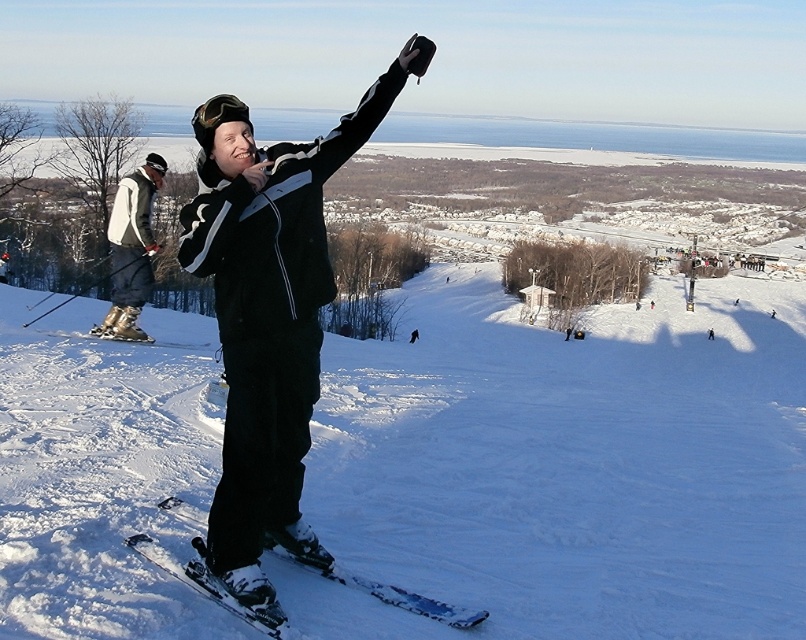
Question: Does matte black snowboard at center have a greater width compared to shiny metallic skis at center?

Choices:
 (A) no
 (B) yes

Answer: (B)

Question: Among these objects, which one is farthest from the camera?

Choices:
 (A) brushed metal ski pole at left
 (B) shiny metallic skis at center

Answer: (A)

Question: Can you confirm if matte black snowboard at center is positioned to the left of shiny metallic skis at center?

Choices:
 (A) no
 (B) yes

Answer: (A)

Question: Which is nearer to the shiny metallic skis at center?

Choices:
 (A) matte black snowboard at center
 (B) brushed metal ski pole at left

Answer: (A)

Question: Where is matte black snowboard at center located in relation to shiny metallic skis at center in the image?

Choices:
 (A) above
 (B) below

Answer: (A)

Question: Which object is positioned closest to the matte black snowboard at center?

Choices:
 (A) shiny metallic skis at center
 (B) brushed metal ski pole at left

Answer: (A)